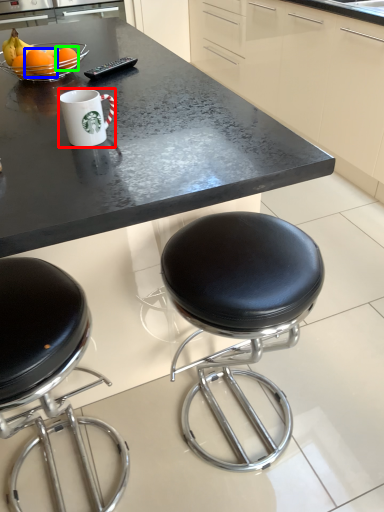
Question: Which is nearer to the coffee cup (highlighted by a red box)? orange (highlighted by a blue box) or orange (highlighted by a green box).

Choices:
 (A) orange
 (B) orange

Answer: (A)